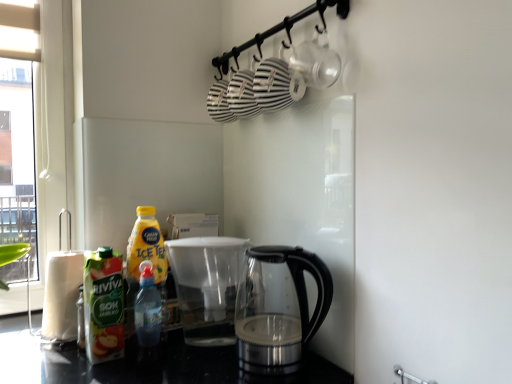
Find the location of a particular element. The image size is (512, 384). transparent glass kettle at lower center is located at coordinates (278, 308).

Where is `white paper towel at left`? This screenshot has height=384, width=512. white paper towel at left is located at coordinates (62, 294).

What are the coordinates of `transparent glass kettle at lower center` in the screenshot? It's located at (278, 308).

The height and width of the screenshot is (384, 512). I want to click on kettle lying on the right of white paper towel at left, so tap(278, 308).

What's the angular difference between white paper towel at left and transparent glass kettle at lower center's facing directions?

They differ by 1.14 degrees in their facing directions.

Can you confirm if white paper towel at left is smaller than transparent glass kettle at lower center?

Yes.

Is white paper towel at left facing towards transparent glass kettle at lower center?

No, white paper towel at left is not oriented towards transparent glass kettle at lower center.

From a real-world perspective, which is physically above, green matte juice at left, the 1th bottle viewed from the left, or transparent glass kettle at lower center?

green matte juice at left, the 1th bottle viewed from the left.

Does green matte juice at left, which is the 2th bottle from right to left, have a smaller size compared to transparent glass kettle at lower center?

Yes, green matte juice at left, which is the 2th bottle from right to left, is smaller than transparent glass kettle at lower center.

Can you confirm if green matte juice at left, which is the 2th bottle from right to left, is thinner than transparent glass kettle at lower center?

Yes, green matte juice at left, which is the 2th bottle from right to left, is thinner than transparent glass kettle at lower center.

Is transparent glass kettle at lower center oriented towards green matte juice at left, which is the 2th bottle from right to left?

No.

Between transparent glass kettle at lower center and green matte juice at left, the 1th bottle viewed from the left, which one has larger size?

transparent glass kettle at lower center is bigger.

From the image's perspective, is transparent glass kettle at lower center located above green matte juice at left, which is the 2th bottle from right to left?

Actually, transparent glass kettle at lower center appears below green matte juice at left, which is the 2th bottle from right to left, in the image.

Can you tell me how much green matte juice at left, the 1th bottle viewed from the left, and white paper towel at left differ in facing direction?

The facing directions of green matte juice at left, the 1th bottle viewed from the left, and white paper towel at left are 2.75 degrees apart.

Which object is thinner, green matte juice at left, the 1th bottle viewed from the left, or white paper towel at left?

Thinner between the two is green matte juice at left, the 1th bottle viewed from the left.

Considering the positions of objects green matte juice at left, which is the 2th bottle from right to left, and white paper towel at left in the image provided, who is behind, green matte juice at left, which is the 2th bottle from right to left, or white paper towel at left?

white paper towel at left is behind.

Considering the relative sizes of green matte juice at left, which is the 2th bottle from right to left, and white paper towel at left in the image provided, is green matte juice at left, which is the 2th bottle from right to left, shorter than white paper towel at left?

In fact, green matte juice at left, which is the 2th bottle from right to left, may be taller than white paper towel at left.

From a real-world perspective, is transparent glass kettle at lower center positioned over translucent plastic bottle at lower left, which appears as the first bottle when viewed from the right, based on gravity?

Yes, from a real-world perspective, transparent glass kettle at lower center is on top of translucent plastic bottle at lower left, which appears as the first bottle when viewed from the right.

From the image's perspective, who appears lower, transparent glass kettle at lower center or translucent plastic bottle at lower left, positioned as the 2th bottle in left-to-right order?

translucent plastic bottle at lower left, positioned as the 2th bottle in left-to-right order, appears lower in the image.

Would you say transparent glass kettle at lower center contains translucent plastic bottle at lower left, positioned as the 2th bottle in left-to-right order?

Result: Definitely not — translucent plastic bottle at lower left, positioned as the 2th bottle in left-to-right order, is not inside transparent glass kettle at lower center.

Between point (54, 296) and point (145, 304), which one is positioned in front?

Point (145, 304)

In terms of height, does white paper towel at left look taller or shorter compared to translucent plastic bottle at lower left, which appears as the first bottle when viewed from the right?

In the image, white paper towel at left appears to be taller than translucent plastic bottle at lower left, which appears as the first bottle when viewed from the right.

Which object is positioned more to the left, white paper towel at left or translucent plastic bottle at lower left, positioned as the 2th bottle in left-to-right order?

white paper towel at left.

Is white paper towel at left placed right next to translucent plastic bottle at lower left, which appears as the first bottle when viewed from the right?

No, white paper towel at left is not beside translucent plastic bottle at lower left, which appears as the first bottle when viewed from the right.

Between white paper towel at left and green matte juice at left, which is the 2th bottle from right to left, which one has smaller width?

With smaller width is green matte juice at left, which is the 2th bottle from right to left.

There is a white paper towel at left. Identify the location of bottle above it (from a real-world perspective). (103, 305).

Does white paper towel at left have a smaller size compared to green matte juice at left, which is the 2th bottle from right to left?

Actually, white paper towel at left might be larger than green matte juice at left, which is the 2th bottle from right to left.

What's the angular difference between white paper towel at left and green matte juice at left, the 1th bottle viewed from the left,'s facing directions?

white paper towel at left and green matte juice at left, the 1th bottle viewed from the left, are facing 2.75 degrees away from each other.

Locate an element on the screen. This screenshot has height=384, width=512. kettle positioned vertically above the white paper towel at left (from a real-world perspective) is located at coordinates (278, 308).

I want to click on the 2nd bottle to the left of the transparent glass kettle at lower center, counting from the anchor's position, so click(103, 305).

From the image, which object appears to be farther from translucent plastic bottle at lower left, which appears as the first bottle when viewed from the right, green matte juice at left, the 1th bottle viewed from the left, or transparent glass kettle at lower center?

transparent glass kettle at lower center.

From the image, which object appears to be nearer to green matte juice at left, which is the 2th bottle from right to left, transparent glass kettle at lower center or translucent plastic bottle at lower left, positioned as the 2th bottle in left-to-right order?

The object closer to green matte juice at left, which is the 2th bottle from right to left, is translucent plastic bottle at lower left, positioned as the 2th bottle in left-to-right order.

Looking at the image, which one is located closer to white paper towel at left, green matte juice at left, which is the 2th bottle from right to left, or transparent glass kettle at lower center?

green matte juice at left, which is the 2th bottle from right to left.

Estimate the real-world distances between objects in this image. Which object is closer to white paper towel at left, translucent plastic bottle at lower left, which appears as the first bottle when viewed from the right, or transparent glass kettle at lower center?

Based on the image, translucent plastic bottle at lower left, which appears as the first bottle when viewed from the right, appears to be nearer to white paper towel at left.

Looking at the image, which one is located closer to transparent glass kettle at lower center, translucent plastic bottle at lower left, positioned as the 2th bottle in left-to-right order, or green matte juice at left, which is the 2th bottle from right to left?

translucent plastic bottle at lower left, positioned as the 2th bottle in left-to-right order, is positioned closer to the anchor transparent glass kettle at lower center.

When comparing their distances from green matte juice at left, which is the 2th bottle from right to left, does white paper towel at left or transparent glass kettle at lower center seem closer?

white paper towel at left lies closer to green matte juice at left, which is the 2th bottle from right to left, than the other object.

When comparing their distances from white paper towel at left, does transparent glass kettle at lower center or translucent plastic bottle at lower left, positioned as the 2th bottle in left-to-right order, seem further?

The object further to white paper towel at left is transparent glass kettle at lower center.

When comparing their distances from translucent plastic bottle at lower left, which appears as the first bottle when viewed from the right, does green matte juice at left, which is the 2th bottle from right to left, or white paper towel at left seem closer?

Among the two, green matte juice at left, which is the 2th bottle from right to left, is located nearer to translucent plastic bottle at lower left, which appears as the first bottle when viewed from the right.

The height and width of the screenshot is (384, 512). In order to click on bottle between green matte juice at left, the 1th bottle viewed from the left, and transparent glass kettle at lower center in this screenshot , I will do `click(147, 309)`.

Where is `bottle between white paper towel at left and translucent plastic bottle at lower left, positioned as the 2th bottle in left-to-right order, in the horizontal direction`? bottle between white paper towel at left and translucent plastic bottle at lower left, positioned as the 2th bottle in left-to-right order, in the horizontal direction is located at coordinates (103, 305).